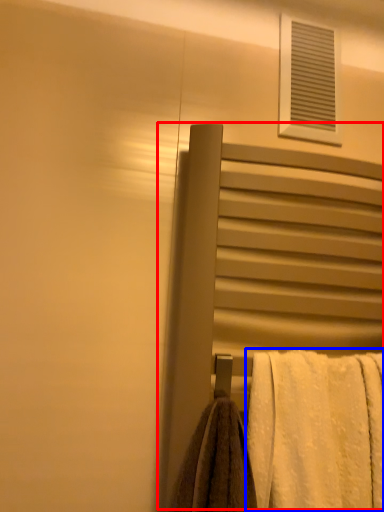
Question: Which point is closer to the camera, screen door (highlighted by a red box) or towel (highlighted by a blue box)?

Choices:
 (A) screen door
 (B) towel

Answer: (B)